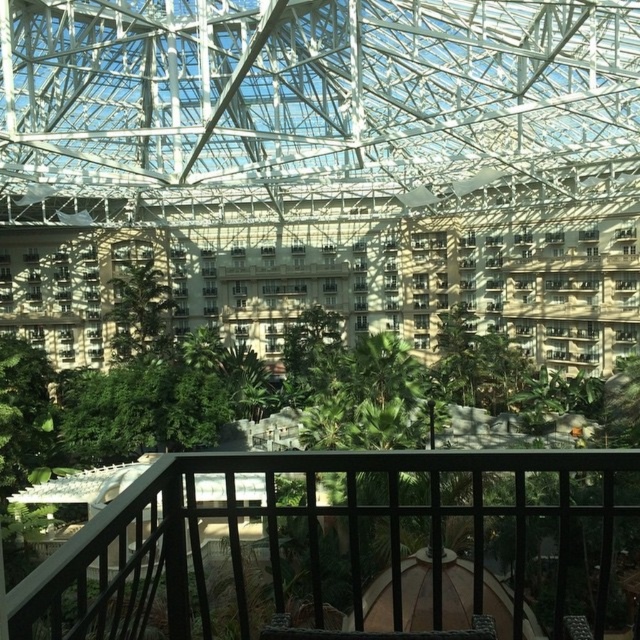
Can you confirm if beige concrete building at center is positioned to the right of green leafy tree at center?

Indeed, beige concrete building at center is positioned on the right side of green leafy tree at center.

Consider the image. Between beige concrete building at center and green leafy tree at center, which one has less height?

Standing shorter between the two is green leafy tree at center.

Is point (124, 246) positioned after point (140, 305)?

Yes, it is behind point (140, 305).

This screenshot has height=640, width=640. I want to click on beige concrete building at center, so click(346, 276).

Who is taller, black wood railing at center or beige concrete building at center?

With more height is beige concrete building at center.

How far apart are black wood railing at center and beige concrete building at center?

black wood railing at center and beige concrete building at center are 26.47 meters apart.

At what (x,y) coordinates should I click in order to perform the action: click on black wood railing at center. Please return your answer as a coordinate pair (x, y). The image size is (640, 640). Looking at the image, I should click on (348, 548).

Locate an element on the screen. black wood railing at center is located at coordinates (348, 548).

Who is positioned more to the right, black wood railing at center or green leafy tree at center?

black wood railing at center

Who is more distant from viewer, (129, 508) or (168, 300)?

Positioned behind is point (168, 300).

I want to click on black wood railing at center, so click(x=348, y=548).